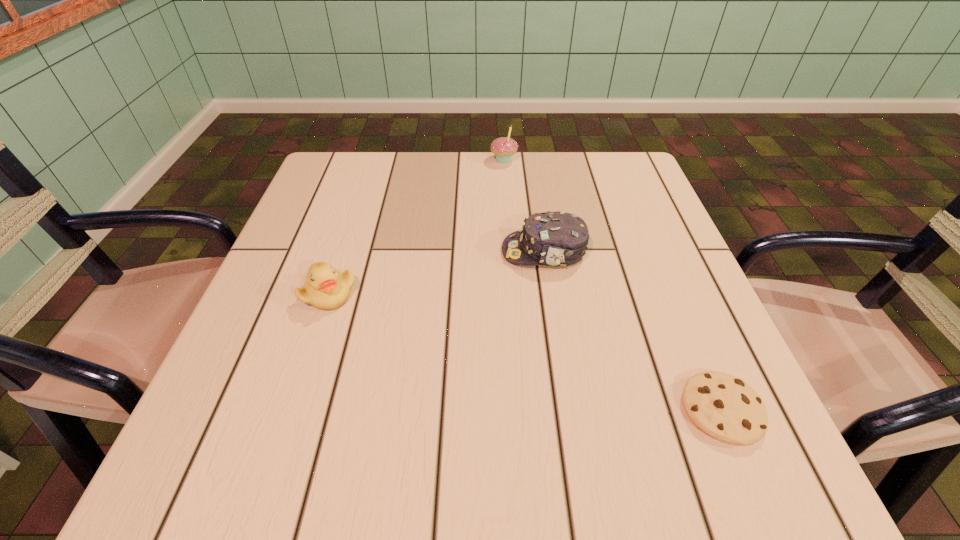
This screenshot has width=960, height=540. In order to click on vacant space at the left edge of the desktop in this screenshot , I will do `click(316, 331)`.

In order to click on free spot at the right edge of the desktop in this screenshot , I will do `click(652, 253)`.

The image size is (960, 540). Identify the location of free space at the near left corner of the desktop. (263, 442).

The image size is (960, 540). I want to click on vacant area at the far right corner of the desktop, so click(630, 183).

In the image, there is a desktop. At what (x,y) coordinates should I click in order to perform the action: click on vacant space at the near right corner. Please return your answer as a coordinate pair (x, y). The height and width of the screenshot is (540, 960). Looking at the image, I should click on (774, 437).

Where is `free area in between the farthest object and the rightmost object`? This screenshot has width=960, height=540. free area in between the farthest object and the rightmost object is located at coordinates (612, 285).

The height and width of the screenshot is (540, 960). I want to click on free spot between the second farthest object and the leftmost object, so click(437, 272).

Where is `free space between the cupcake and the headwear`? The image size is (960, 540). free space between the cupcake and the headwear is located at coordinates (524, 206).

Where is `blank region between the rightmost object and the tallest object`? Image resolution: width=960 pixels, height=540 pixels. blank region between the rightmost object and the tallest object is located at coordinates point(612,285).

At what (x,y) coordinates should I click in order to perform the action: click on vacant area that lies between the nearest object and the farthest object. Please return your answer as a coordinate pair (x, y). The image size is (960, 540). Looking at the image, I should click on (612, 285).